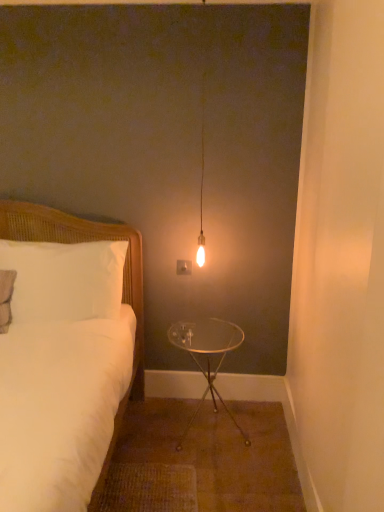
The height and width of the screenshot is (512, 384). Find the location of `white wicker pillow at left`. white wicker pillow at left is located at coordinates (64, 279).

In order to face white wicker pillow at left, should I rotate leftwards or rightwards?

It's best to rotate left around 17.074 degrees.

In order to click on clear glass table at center in this screenshot , I will do `click(207, 355)`.

Describe the element at coordinates (202, 180) in the screenshot. I see `matte glass bulb at center` at that location.

At what (x,y) coordinates should I click in order to perform the action: click on white wicker pillow at left. Please return your answer as a coordinate pair (x, y). Looking at the image, I should click on (64, 279).

Can you tell me how much white wicker pillow at left and matte glass bulb at center differ in facing direction?

They differ by 0.512 degrees in their facing directions.

Measure the distance between white wicker pillow at left and matte glass bulb at center.

The distance of white wicker pillow at left from matte glass bulb at center is 28.36 inches.

Based on the photo, is white wicker pillow at left turned away from matte glass bulb at center?

No, white wicker pillow at left's orientation is not away from matte glass bulb at center.

Looking at this image, which of these two, white wicker pillow at left or matte glass bulb at center, is wider?

Wider between the two is white wicker pillow at left.

Is clear glass table at center in front of white wicker pillow at left?

No, it is behind white wicker pillow at left.

From a real-world perspective, is clear glass table at center positioned under white wicker pillow at left based on gravity?

Yes, from a real-world perspective, clear glass table at center is below white wicker pillow at left.

Which is in front, point (213, 380) or point (65, 249)?

The point (65, 249) is more forward.

Is clear glass table at center located within white wicker pillow at left?

Actually, clear glass table at center is outside white wicker pillow at left.

Between white wicker pillow at left and clear glass table at center, which one has larger width?

With larger width is clear glass table at center.

From a real-world perspective, is white wicker pillow at left above or below clear glass table at center?

From a real-world perspective, white wicker pillow at left is physically above clear glass table at center.

Which object is positioned more to the left, white wicker pillow at left or clear glass table at center?

white wicker pillow at left.

Choose the correct answer: Is matte glass bulb at center inside white wicker pillow at left or outside it?

matte glass bulb at center is located beyond the bounds of white wicker pillow at left.

Find the location of a particular element. The image size is (384, 512). lamp that is in front of the white wicker pillow at left is located at coordinates (202, 180).

Which object is positioned more to the left, matte glass bulb at center or white wicker pillow at left?

From the viewer's perspective, white wicker pillow at left appears more on the left side.

From a real-world perspective, is matte glass bulb at center above or below white wicker pillow at left?

Clearly, from a real-world perspective, matte glass bulb at center is above white wicker pillow at left.

From a real-world perspective, does white wicker pillow at left stand above white woven bed at left?

Indeed, from a real-world perspective, white wicker pillow at left stands above white woven bed at left.

Considering the relative sizes of white wicker pillow at left and white woven bed at left in the image provided, is white wicker pillow at left shorter than white woven bed at left?

Yes, white wicker pillow at left is shorter than white woven bed at left.

Is white wicker pillow at left looking in the opposite direction of white woven bed at left?

Yes, white wicker pillow at left is facing away from white woven bed at left.

From the picture: Which is closer to the camera, (74, 313) or (4, 207)?

Point (74, 313)

Does white woven bed at left have a smaller size compared to matte glass bulb at center?

Actually, white woven bed at left might be larger than matte glass bulb at center.

Is white woven bed at left in front of or behind matte glass bulb at center in the image?

white woven bed at left is in front of matte glass bulb at center.

In terms of height, does white woven bed at left look taller or shorter compared to matte glass bulb at center?

In the image, white woven bed at left appears to be shorter than matte glass bulb at center.

The height and width of the screenshot is (512, 384). Identify the location of lamp on the left of clear glass table at center. (202, 180).

From a real-world perspective, is clear glass table at center positioned above or below matte glass bulb at center?

From a real-world perspective, clear glass table at center is physically below matte glass bulb at center.

Does clear glass table at center come in front of matte glass bulb at center?

That is False.

Consider the image. Visually, is clear glass table at center positioned to the left or to the right of matte glass bulb at center?

Answer: From the image, it's evident that clear glass table at center is to the right of matte glass bulb at center.

The image size is (384, 512). Find the location of `lamp to the right of white wicker pillow at left`. lamp to the right of white wicker pillow at left is located at coordinates (202, 180).

The width and height of the screenshot is (384, 512). What are the coordinates of `table below the white wicker pillow at left (from the image's perspective)` in the screenshot? It's located at (207, 355).

Looking at the image, which one is located closer to white woven bed at left, clear glass table at center or white wicker pillow at left?

Among the two, white wicker pillow at left is located nearer to white woven bed at left.

Estimate the real-world distances between objects in this image. Which object is further from white woven bed at left, white wicker pillow at left or matte glass bulb at center?

matte glass bulb at center is positioned further to the anchor white woven bed at left.

From the image, which object appears to be nearer to white woven bed at left, clear glass table at center or matte glass bulb at center?

clear glass table at center is positioned closer to the anchor white woven bed at left.

Which object lies nearer to the anchor point clear glass table at center, white wicker pillow at left or white woven bed at left?

The object closer to clear glass table at center is white woven bed at left.

When comparing their distances from clear glass table at center, does matte glass bulb at center or white woven bed at left seem further?

The object further to clear glass table at center is matte glass bulb at center.

Looking at the image, which one is located further to clear glass table at center, white woven bed at left or white wicker pillow at left?

white wicker pillow at left.

Estimate the real-world distances between objects in this image. Which object is further from matte glass bulb at center, white woven bed at left or white wicker pillow at left?

white wicker pillow at left is further to matte glass bulb at center.

Which object lies further to the anchor point white wicker pillow at left, white woven bed at left or clear glass table at center?

clear glass table at center lies further to white wicker pillow at left than the other object.

Where is `pillow between matte glass bulb at center and clear glass table at center in the up-down direction`? pillow between matte glass bulb at center and clear glass table at center in the up-down direction is located at coordinates (64, 279).

The height and width of the screenshot is (512, 384). In order to click on lamp between white woven bed at left and clear glass table at center from front to back in this screenshot , I will do `click(202, 180)`.

Locate an element on the screen. The image size is (384, 512). pillow between white woven bed at left and clear glass table at center in the front-back direction is located at coordinates (64, 279).

Locate an element on the screen. The height and width of the screenshot is (512, 384). lamp located between white woven bed at left and white wicker pillow at left in the depth direction is located at coordinates (202, 180).